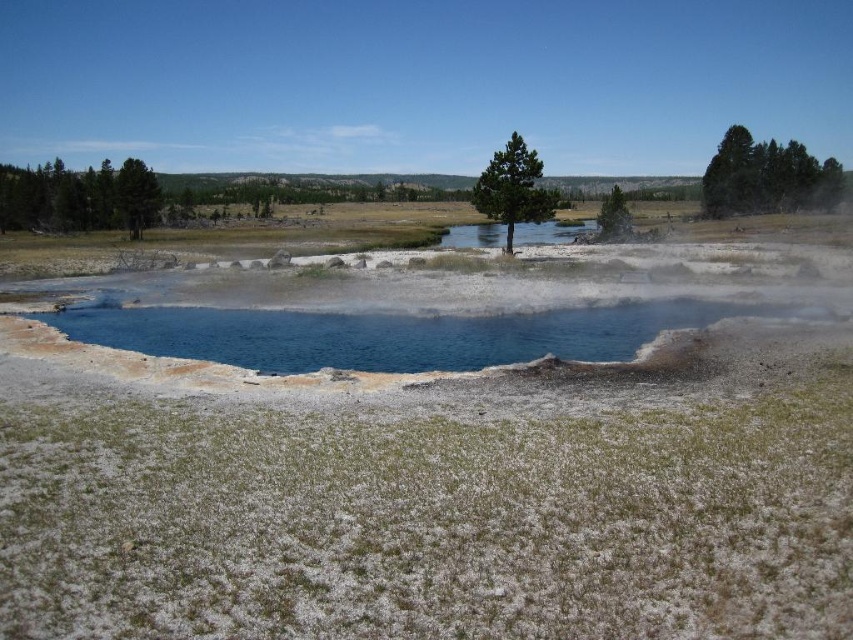
Question: Estimate the real-world distances between objects in this image. Which object is closer to the green textured tree at upper right?

Choices:
 (A) green matte tree at left
 (B) green leafy tree at upper center

Answer: (B)

Question: Which object is the farthest from the blue water at center?

Choices:
 (A) green textured tree at left
 (B) green matte tree at center
 (C) green matte tree at left
 (D) green textured tree at upper right

Answer: (D)

Question: Can you confirm if green textured tree at left is positioned below green leafy tree at upper center?

Choices:
 (A) yes
 (B) no

Answer: (A)

Question: Which point appears farthest from the camera in this image?

Choices:
 (A) click(x=601, y=236)
 (B) click(x=488, y=298)
 (C) click(x=131, y=180)

Answer: (C)

Question: Does green textured tree at left have a lesser width compared to green matte tree at left?

Choices:
 (A) yes
 (B) no

Answer: (B)

Question: Is blue water at center thinner than green matte tree at center?

Choices:
 (A) no
 (B) yes

Answer: (A)